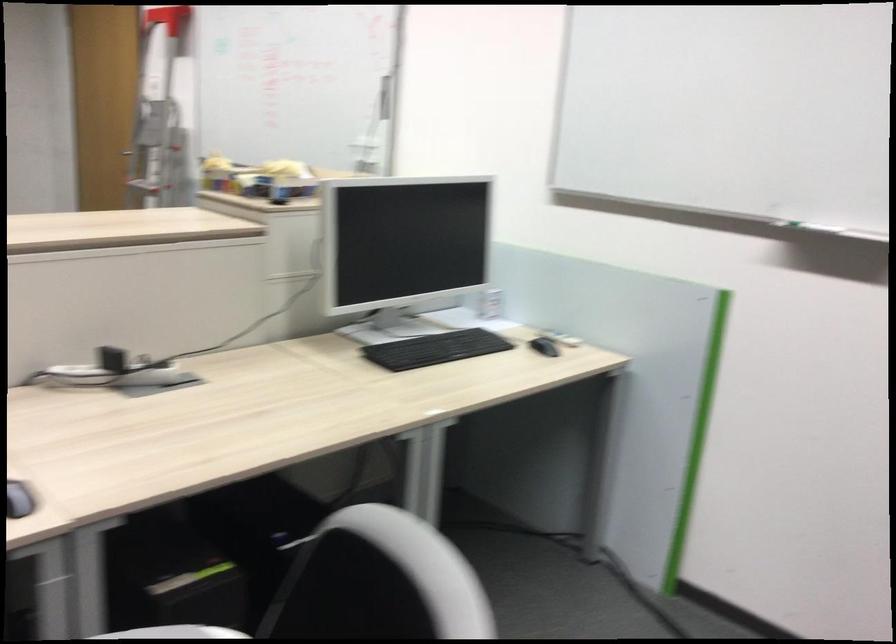
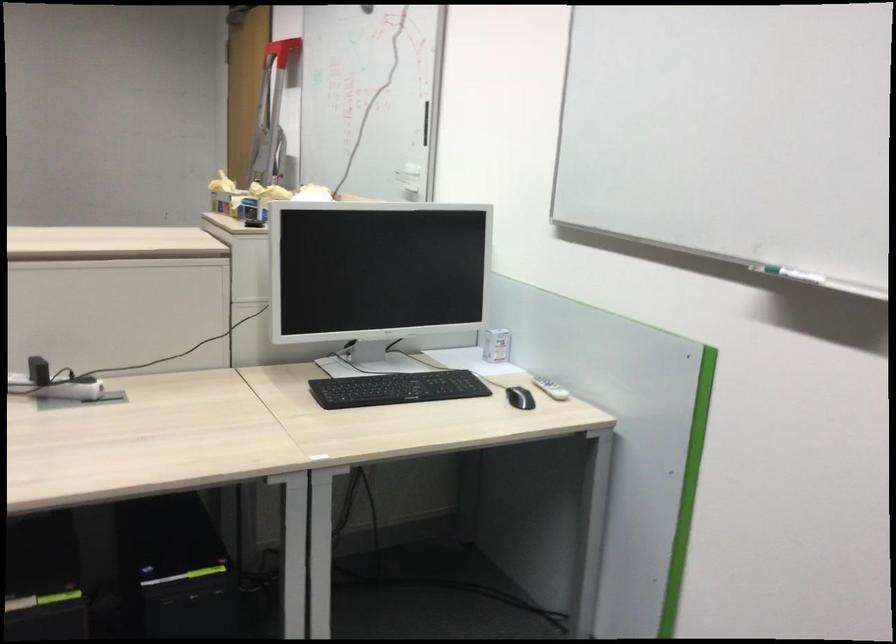
Where in the second image is the point corresponding to the point at 814,227 from the first image?

(794, 275)